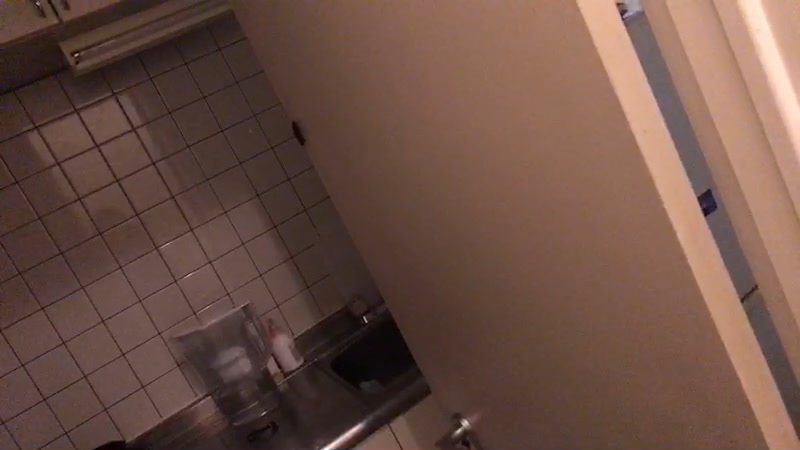
You are a GUI agent. You are given a task and a screenshot of the screen. Output one action in this format:
    pyautogui.click(x=<x>, y=<y>)
    Task: Click on the gap in door and wall
    
    Given the screenshot: What is the action you would take?
    pyautogui.click(x=690, y=150)